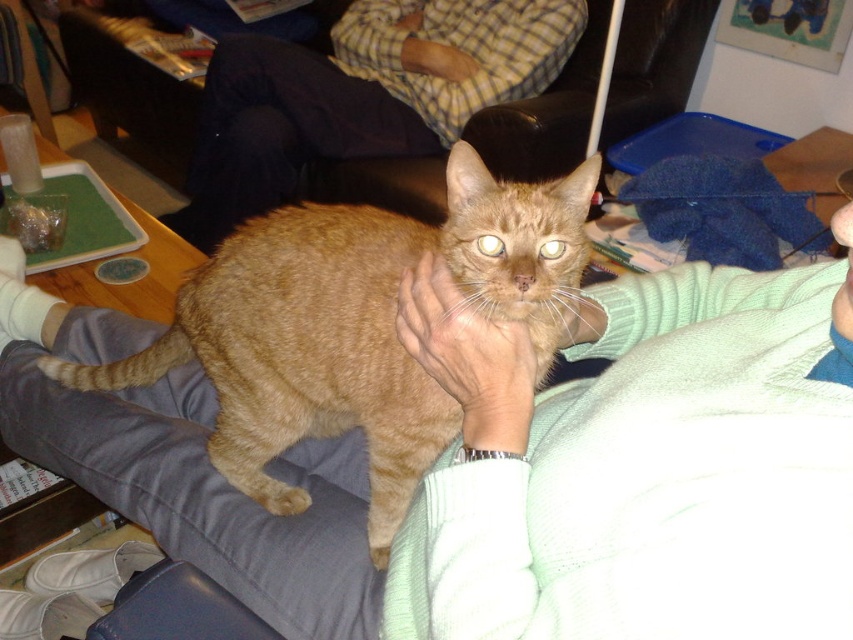
You are a photographer trying to capture the orange tabby cat at center. The camera you are using has a focus point at coordinate point [355,326]. Will this focus point align with the cat?

Yes, the point [355,326] corresponds to the orange tabby cat at center, so the focus point will align with the cat.

You are a photographer trying to capture the orange tabby cat at center and the checkered shirt at upper center in the same frame. Can you see both objects clearly without moving the camera?

The orange tabby cat at center is in front of the checkered shirt at upper center, so the checkered shirt at upper center may be partially obscured by the cat. You might need to adjust the camera angle or move the cat to ensure both are visible clearly.

You are a photographer trying to capture a closeup of the ginger cat in the scene. You notice two points marked in the image. Which point, point (379, 502) or point (200, 244), is closer to your camera lens?

Point (379, 502) is closer to the camera lens than point (200, 244).